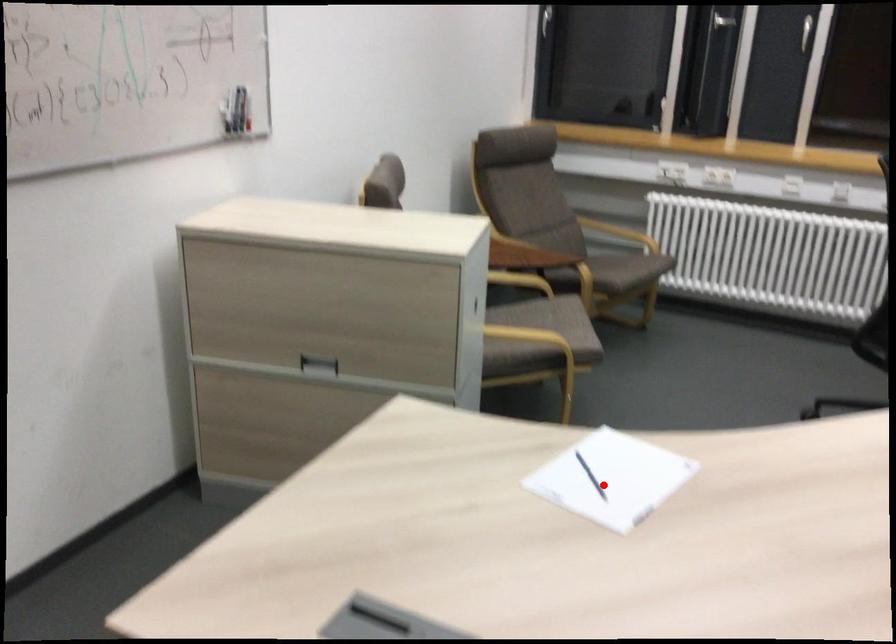
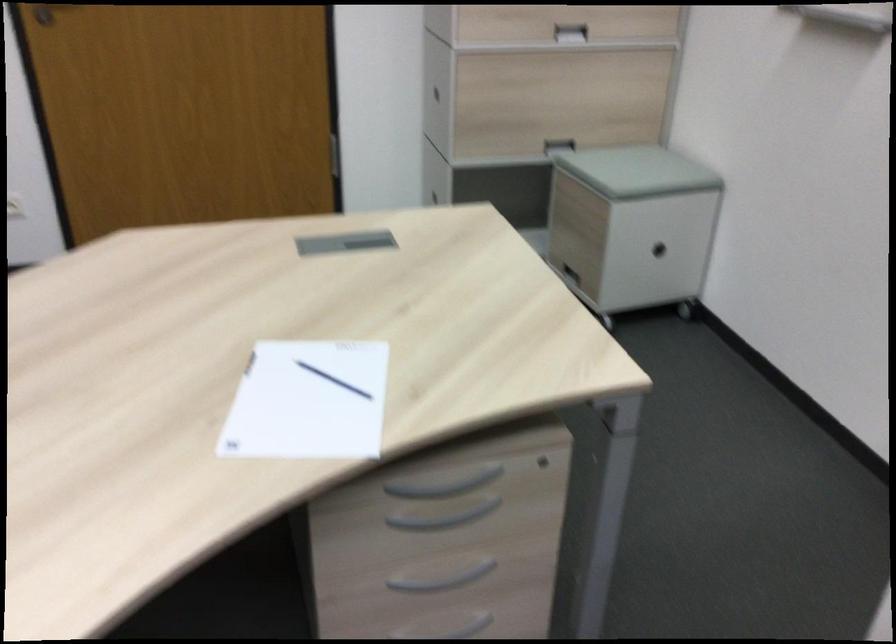
Question: I am providing you with two images of the same scene from different viewpoints. Image1 has a red point marked. In image2, the corresponding 3D location appears at what relative position? Reply with the corresponding letter.

Choices:
 (A) Closer
 (B) Farther

Answer: (A)